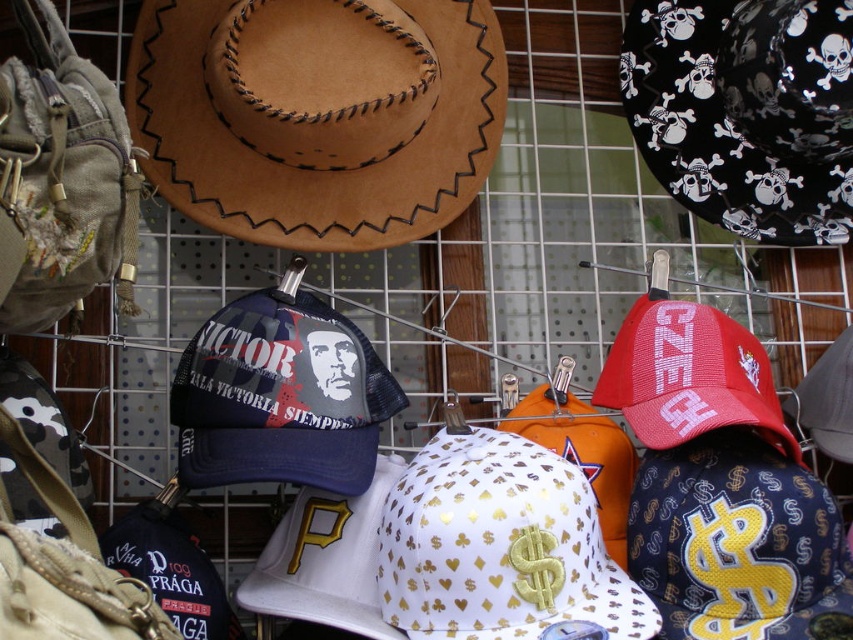
You are a customer at a store and see the black matte cowboy hat at upper right and the gold metallic baseball cap at center. Which one is located above the other?

The black matte cowboy hat at upper right is positioned over the gold metallic baseball cap at center, so it is located above the other.

You are a customer trying to reach the black matte cowboy hat at upper right from the brown suede cowboy hat at upper left. Which direction should you move your hand to grab it?

The brown suede cowboy hat at upper left is closer to the viewer than the black matte cowboy hat at upper right, so you should move your hand backward to grab the black matte cowboy hat at upper right.

In the scene shown: You are a delivery person who needs to place a new hat between the brown suede cowboy hat at upper left and the black matte cowboy hat at upper right on the rack. The new hat has a diameter of 8 inches. Is there enough space between them to fit the new hat without overlapping?

The distance between the brown suede cowboy hat at upper left and the black matte cowboy hat at upper right is 17.12 inches. Since the new hat has a diameter of 8 inches, there is sufficient space as 17.12 inches is greater than 8 inches.